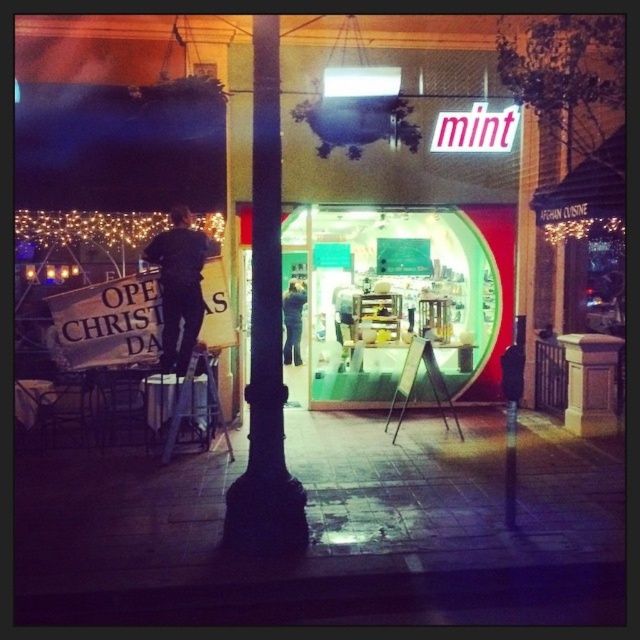
Which of these two, illuminated string lights at upper left or metallic silver ladder at center, stands taller?

Standing taller between the two is metallic silver ladder at center.

Between illuminated string lights at upper left and metallic silver ladder at center, which one is positioned higher?

illuminated string lights at upper left

What do you see at coordinates (88, 227) in the screenshot?
I see `illuminated string lights at upper left` at bounding box center [88, 227].

The height and width of the screenshot is (640, 640). In order to click on illuminated string lights at upper left in this screenshot , I will do `click(88, 227)`.

Can you confirm if dark blue jeans at left is wider than illuminated string lights at upper left?

No, dark blue jeans at left is not wider than illuminated string lights at upper left.

Between point (180, 342) and point (26, 221), which one is positioned behind?

Positioned behind is point (180, 342).

Which is behind, point (172, 337) or point (17, 230)?

The point (17, 230) is more distant.

You are a GUI agent. You are given a task and a screenshot of the screen. Output one action in this format:
    pyautogui.click(x=<x>, y=<y>)
    Task: Click on the dark blue jeans at left
    
    Given the screenshot: What is the action you would take?
    pyautogui.click(x=179, y=285)

Find the location of a particular element. The image size is (640, 640). black matte pole at center is located at coordinates (266, 337).

Who is positioned more to the left, black matte pole at center or illuminated string lights at upper left?

From the viewer's perspective, illuminated string lights at upper left appears more on the left side.

Does point (269, 404) come in front of point (134, 220)?

That is True.

Identify the location of black matte pole at center. (266, 337).